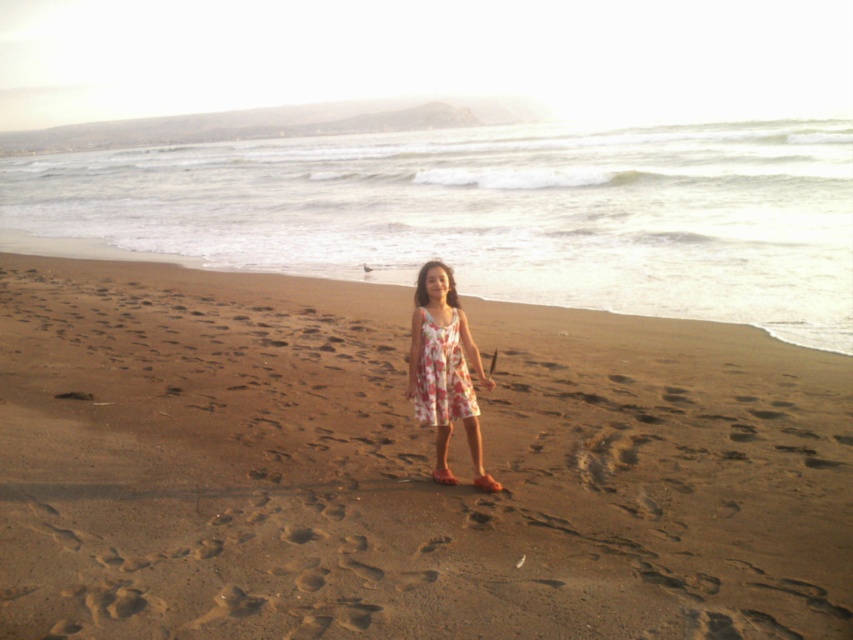
Can you confirm if floral fabric dress at center is positioned below floral cotton dress at center?

Correct, floral fabric dress at center is located below floral cotton dress at center.

Can you confirm if floral fabric dress at center is bigger than floral cotton dress at center?

Yes.

The image size is (853, 640). Describe the element at coordinates (444, 369) in the screenshot. I see `floral fabric dress at center` at that location.

At what (x,y) coordinates should I click in order to perform the action: click on floral fabric dress at center. Please return your answer as a coordinate pair (x, y). The width and height of the screenshot is (853, 640). Looking at the image, I should click on (444, 369).

Between brown sandy beach at center and floral fabric dress at center, which one appears on the left side from the viewer's perspective?

From the viewer's perspective, brown sandy beach at center appears more on the left side.

Can you confirm if brown sandy beach at center is taller than floral fabric dress at center?

Indeed, brown sandy beach at center has a greater height compared to floral fabric dress at center.

Between point (540, 381) and point (450, 388), which one is positioned behind?

Point (540, 381)

Identify the location of brown sandy beach at center. (403, 468).

Who is taller, brown sandy beach at center or floral cotton dress at center?

Standing taller between the two is brown sandy beach at center.

Find the location of a particular element. This screenshot has height=640, width=853. brown sandy beach at center is located at coordinates (403, 468).